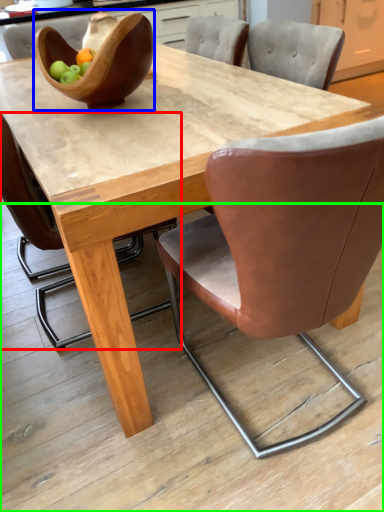
Question: Which object is positioned farthest from chair (highlighted by a red box)? Select from bowl (highlighted by a blue box) and concrete (highlighted by a green box).

Choices:
 (A) bowl
 (B) concrete

Answer: (B)